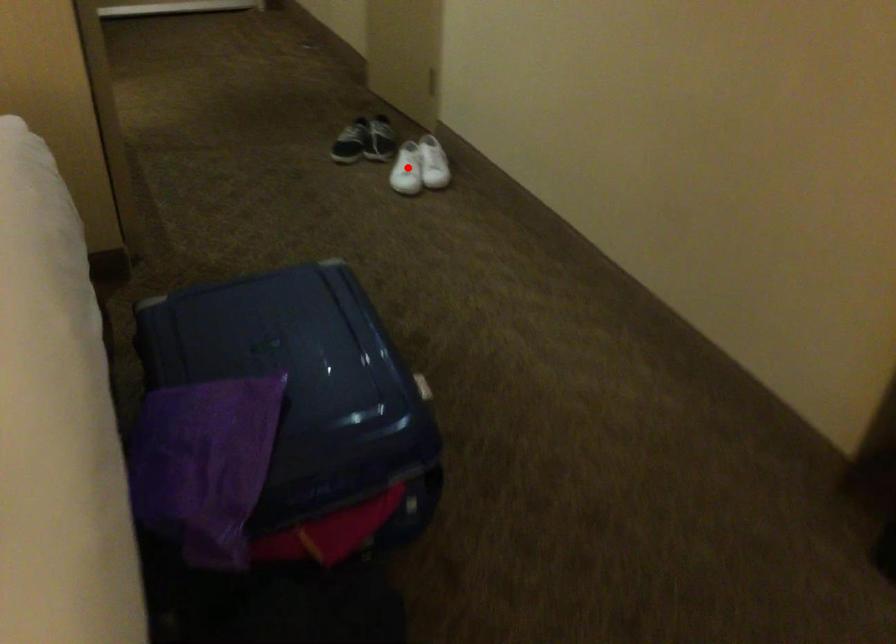
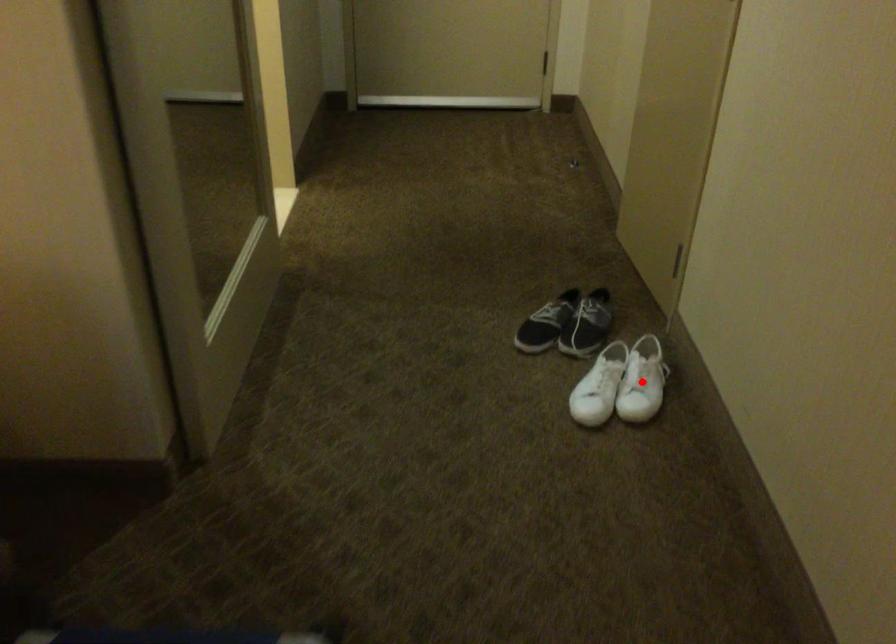
I am providing you with two images of the same scene from different viewpoints. A red point is marked on the first image and another point is marked on the second image. Is the marked point in image1 the same physical position as the marked point in image2?

No